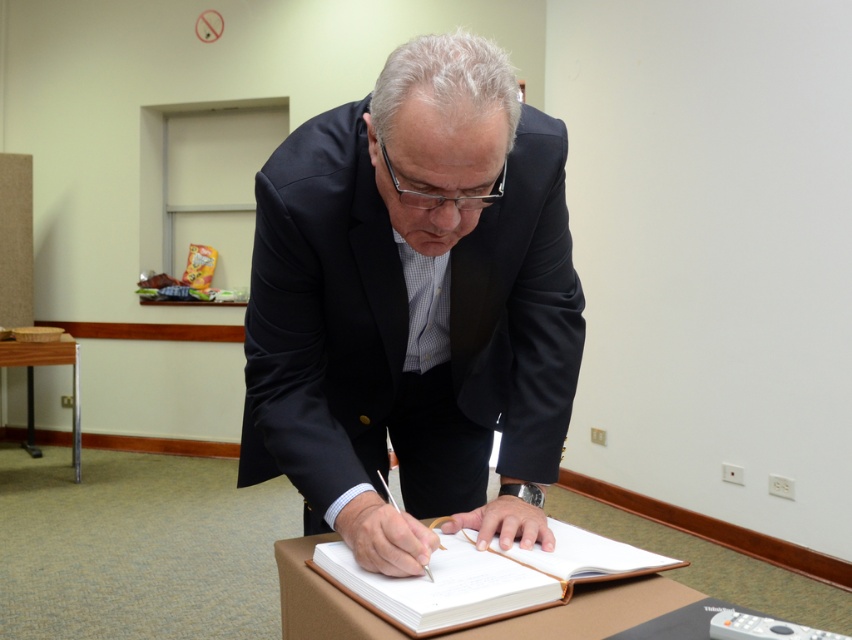
You are a tailor standing 36 inches away from the black satin suit at center. Can you reach to adjust the collar without moving closer?

The distance between you and the black satin suit at center is 36.34 inches, so yes, you can adjust the collar without moving closer since 36.34 inches is just slightly more than 36 inches, but within a reachable distance for most people.

Where is the black satin suit at center located in the image?

The black satin suit at center is located at point coordinates of (x=413, y=304).

In the scene shown: You are a photographer trying to capture a closeup of the black satin suit at center. The camera you are using has a minimum focusing distance of 36 inches. Can you take the photo without moving either the camera or the suit?

The black satin suit at center and camera are 36.34 inches apart from each other. Since the minimum focusing distance is 36 inches, the camera can focus on the black satin suit at center as the distance is slightly more than the required 36 inches.